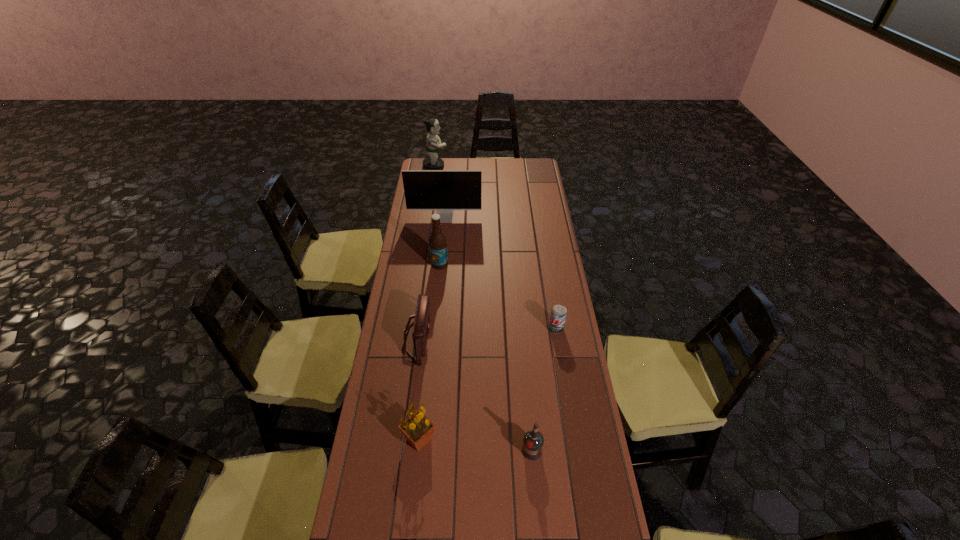
Locate an element on the screen. The image size is (960, 540). figurine is located at coordinates (433, 142).

In order to click on the second farthest object in this screenshot , I will do `click(443, 190)`.

Where is `the third farthest object`? This screenshot has width=960, height=540. the third farthest object is located at coordinates (437, 242).

Locate an element on the screen. the fourth shortest object is located at coordinates (417, 428).

Locate an element on the screen. vodka is located at coordinates (533, 441).

This screenshot has width=960, height=540. What are the coordinates of `shoulder bag` in the screenshot? It's located at (420, 332).

Identify the location of the rightmost object. (558, 312).

This screenshot has width=960, height=540. I want to click on the shortest object, so click(x=558, y=312).

Identify the location of vacant space positioned 0.260m on the front-facing side of the figurine. (491, 166).

This screenshot has height=540, width=960. Find the location of `vacant point located on the front-facing side of the second farthest object`. vacant point located on the front-facing side of the second farthest object is located at coordinates (439, 275).